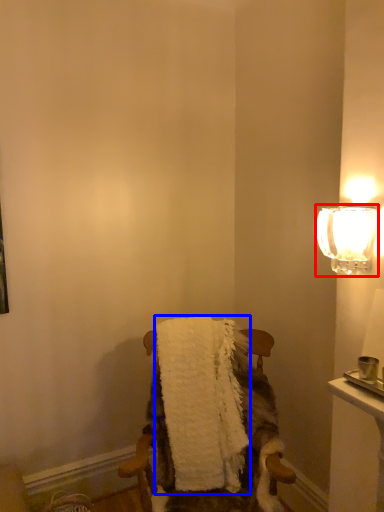
Question: Among these objects, which one is farthest to the camera, lamp (highlighted by a red box) or bath towel (highlighted by a blue box)?

Choices:
 (A) lamp
 (B) bath towel

Answer: (B)